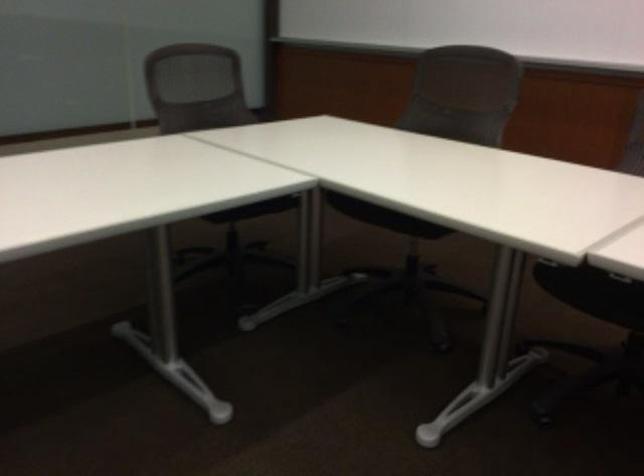
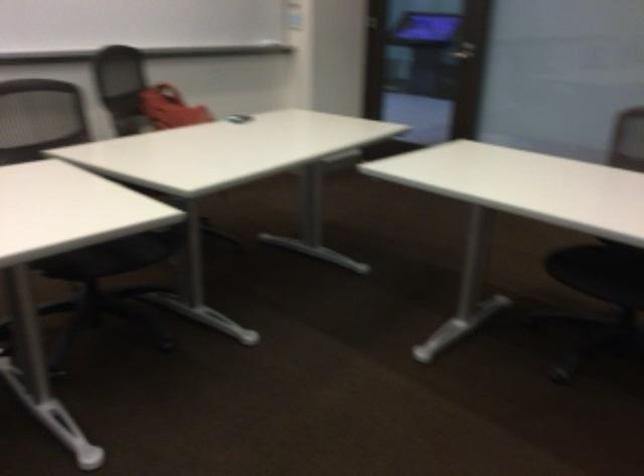
How did the camera likely rotate?

The camera rotated toward left-down.